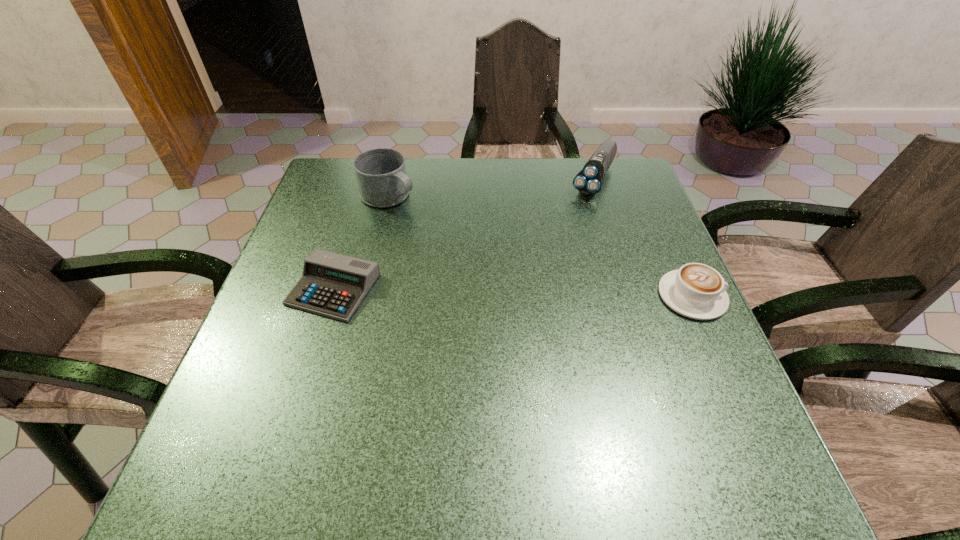
Where is `vacant space at the left edge`? The width and height of the screenshot is (960, 540). vacant space at the left edge is located at coordinates (323, 216).

Locate an element on the screen. This screenshot has height=540, width=960. free space at the right edge is located at coordinates [656, 245].

Locate an element on the screen. free point at the near left corner is located at coordinates (259, 416).

The width and height of the screenshot is (960, 540). I want to click on vacant region at the far right corner of the desktop, so click(x=578, y=158).

At what (x,y) coordinates should I click in order to perform the action: click on free space at the near right corner. Please return your answer as a coordinate pair (x, y). This screenshot has width=960, height=540. Looking at the image, I should click on (747, 416).

Where is `vacant area that lies between the calculator and the mug`? The image size is (960, 540). vacant area that lies between the calculator and the mug is located at coordinates (361, 242).

This screenshot has height=540, width=960. In order to click on unoccupied position between the tallest object and the calculator in this screenshot , I will do `click(361, 242)`.

Locate an element on the screen. The height and width of the screenshot is (540, 960). vacant area between the cappuccino and the shortest object is located at coordinates (513, 293).

You are a GUI agent. You are given a task and a screenshot of the screen. Output one action in this format:
    pyautogui.click(x=<x>, y=<y>)
    Task: Click on the vacant space that is in between the shortest object and the mug
    
    Given the screenshot: What is the action you would take?
    pyautogui.click(x=361, y=242)

At what (x,y) coordinates should I click in order to perform the action: click on free space between the cappuccino and the mug. Please return your answer as a coordinate pair (x, y). The image size is (960, 540). Looking at the image, I should click on (540, 246).